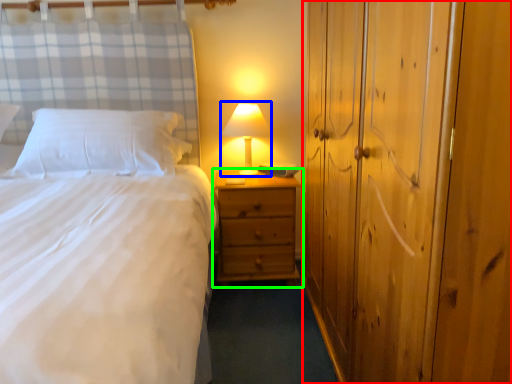
Question: Which is farther away from dresser (highlighted by a red box)? table lamp (highlighted by a blue box) or nightstand (highlighted by a green box)?

Choices:
 (A) table lamp
 (B) nightstand

Answer: (A)